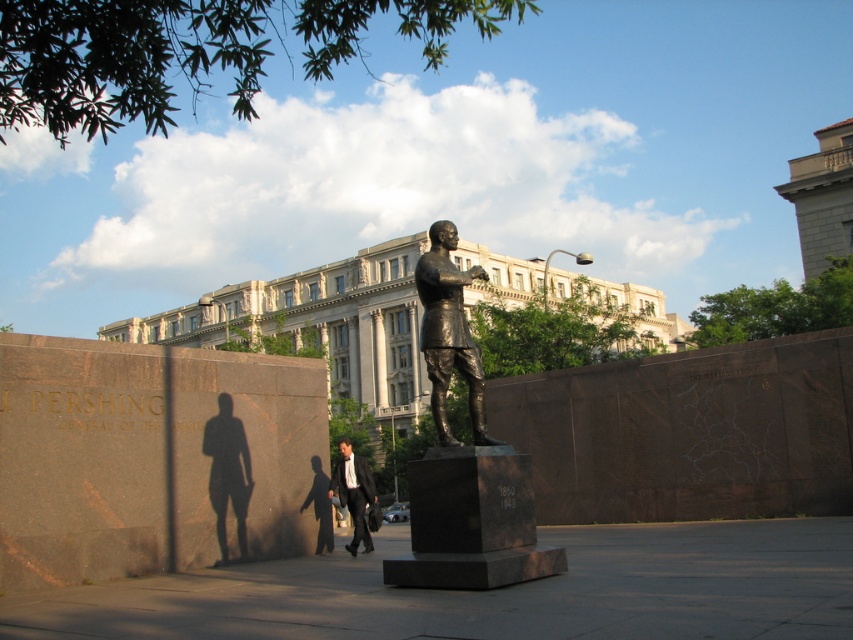
Can you confirm if shiny bronze statue at center is thinner than bronze statue at center?

Indeed, shiny bronze statue at center has a lesser width compared to bronze statue at center.

Between shiny bronze statue at center and bronze statue at center, which one appears on the right side from the viewer's perspective?

From the viewer's perspective, shiny bronze statue at center appears more on the right side.

I want to click on shiny bronze statue at center, so click(x=463, y=464).

This screenshot has width=853, height=640. I want to click on shiny bronze statue at center, so click(463, 464).

Is point (419, 269) positioned before point (352, 461)?

Yes, it is in front of point (352, 461).

Does point (462, 282) come farther from viewer compared to point (341, 470)?

No, (462, 282) is closer to viewer.

Locate an element on the screen. The image size is (853, 640). shiny bronze statue at center is located at coordinates (463, 464).

Does bronze statue at center appear under black suit at center?

Actually, bronze statue at center is above black suit at center.

Between point (480, 444) and point (338, 477), which one is positioned behind?

The point (338, 477) is behind.

The height and width of the screenshot is (640, 853). I want to click on bronze statue at center, so click(450, 332).